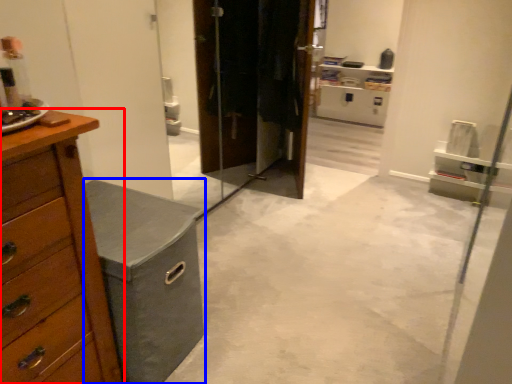
Question: Which of the following is the closest to the observer, chest of drawers (highlighted by a red box) or vanity (highlighted by a blue box)?

Choices:
 (A) chest of drawers
 (B) vanity

Answer: (A)